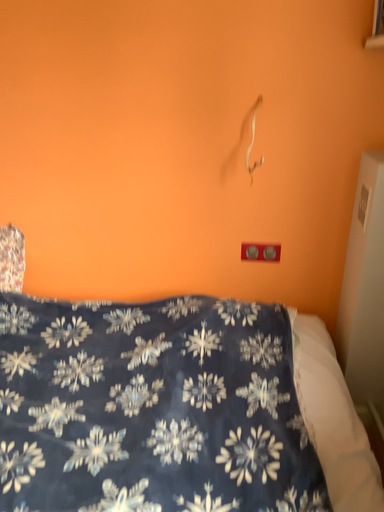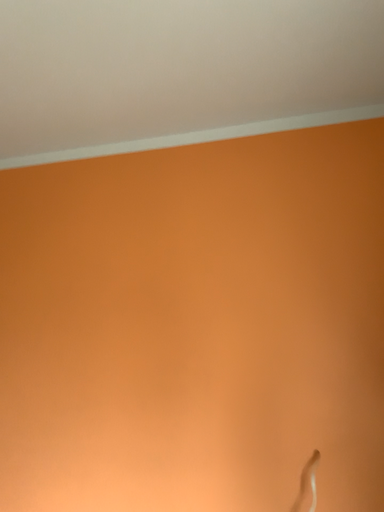
Question: How did the camera likely rotate when shooting the video?

Choices:
 (A) rotated downward
 (B) rotated upward

Answer: (B)